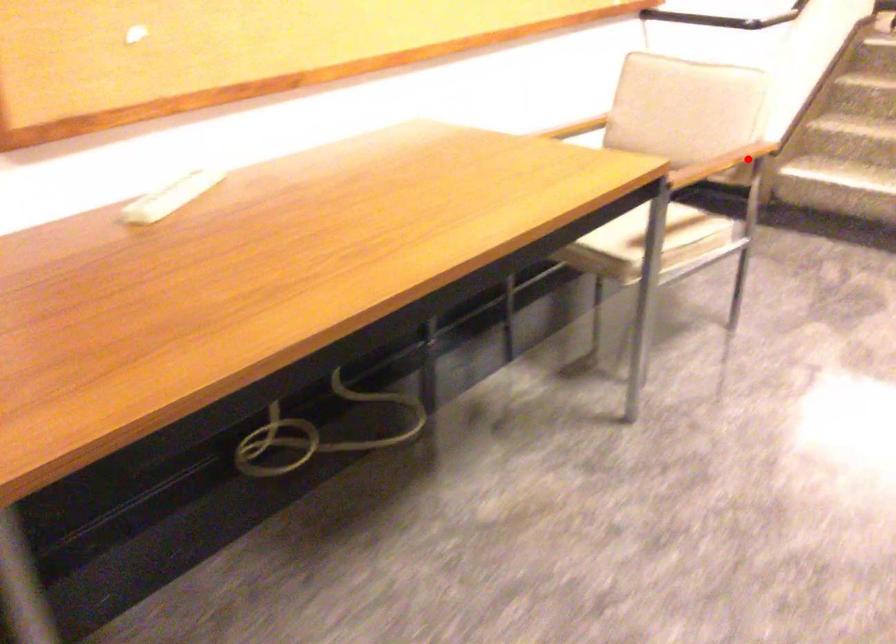
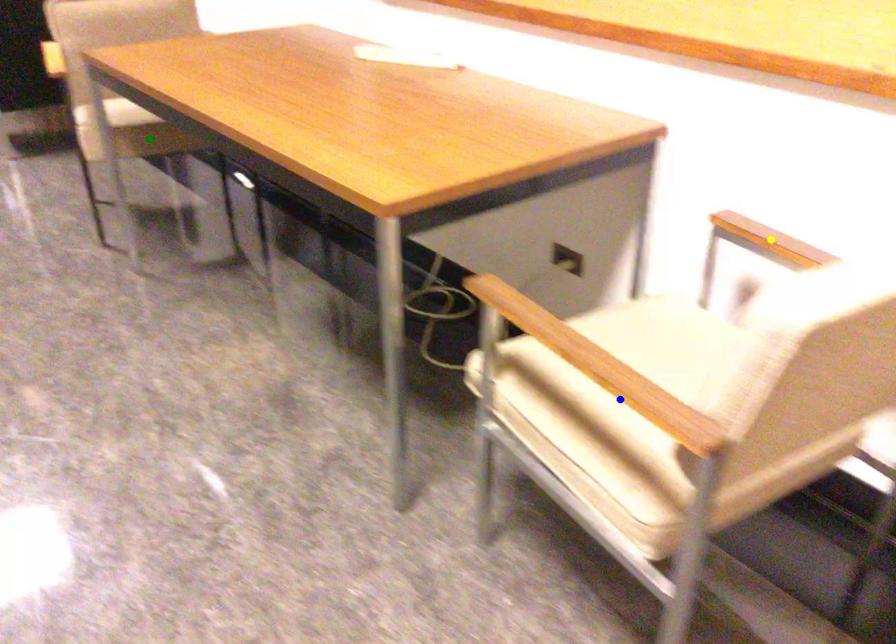
Question: I am providing you with two images of the same scene from different viewpoints. A red point is marked on the first image. You are given multiple points on the second image. Which point in image 2 represents the same 3d spot as the red point in image 1?

Choices:
 (A) blue point
 (B) yellow point
 (C) green point

Answer: (A)